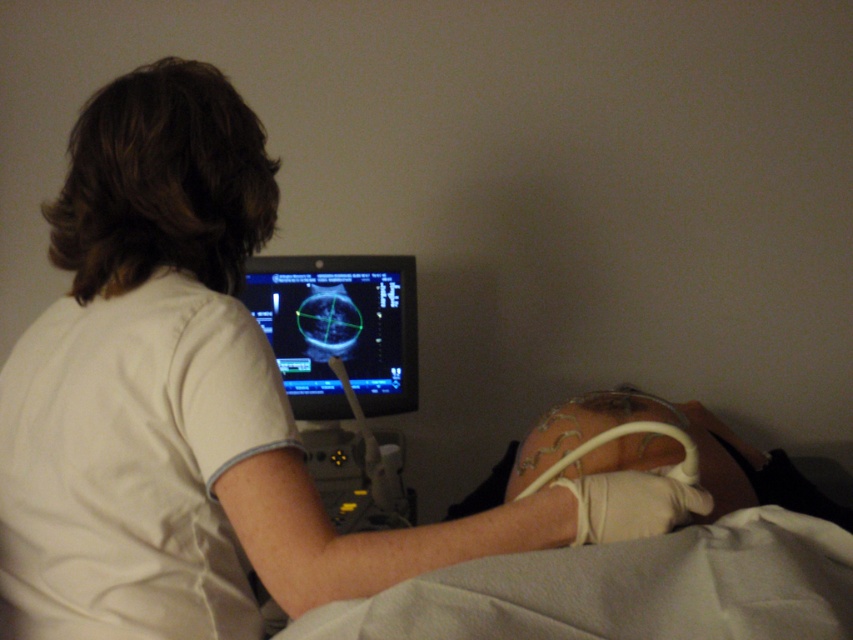
Looking at this image, you are a medical student observing an ultrasound procedure. You notice the white fabric bed at lower center and the black glossy monitor at center. From your perspective, which object is positioned to the left?

The black glossy monitor at center is positioned to the left of the white fabric bed at lower center.

You are a medical student positioned at the camera location. You need to adjust the settings on the monitor in front of you, which is placed on the white fabric bed at lower center. Can you comfortably reach the monitor if your arm can extend 24 inches?

The white fabric bed at lower center is 26.06 inches from camera, which is beyond your arm extension of 24 inches. Therefore, you cannot comfortably reach the monitor placed on the white fabric bed at lower center.